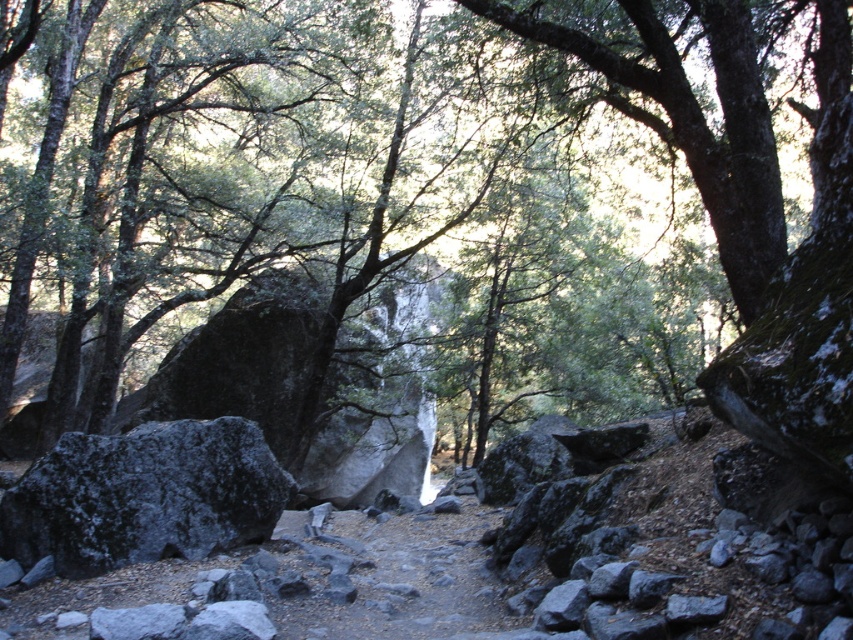
You are standing at the edge of a forest clearing and see a green mossy rock at center. There is a point marked at coordinates (416, 179). Where is this point located?

The point marked at coordinates (416, 179) is on the green mossy rock at center.

You are a hiker trying to cross a rocky area. You see a green mossy rock at center and a gray rough rock at left. Which rock should you step on to avoid slipping, considering their size?

The green mossy rock at center is bigger than the gray rough rock at left, so stepping on the larger one might provide a more stable footing to avoid slipping.

You are a hiker trying to navigate through the forest. You see the green mossy rock at center and the gray rough rock at left. Which rock is positioned to the right of the other?

The green mossy rock at center is positioned to the right of the gray rough rock at left.